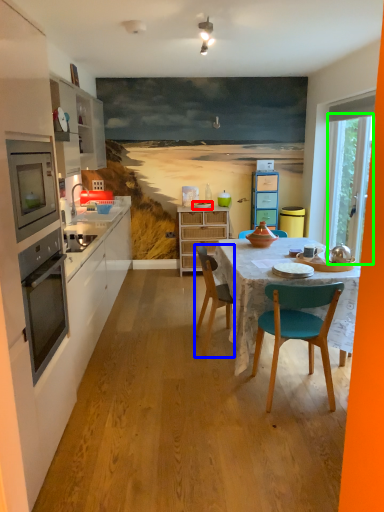
Question: Which object is positioned closest to plate (highlighted by a red box)? Select from chair (highlighted by a blue box) and glass door (highlighted by a green box).

Choices:
 (A) chair
 (B) glass door

Answer: (B)